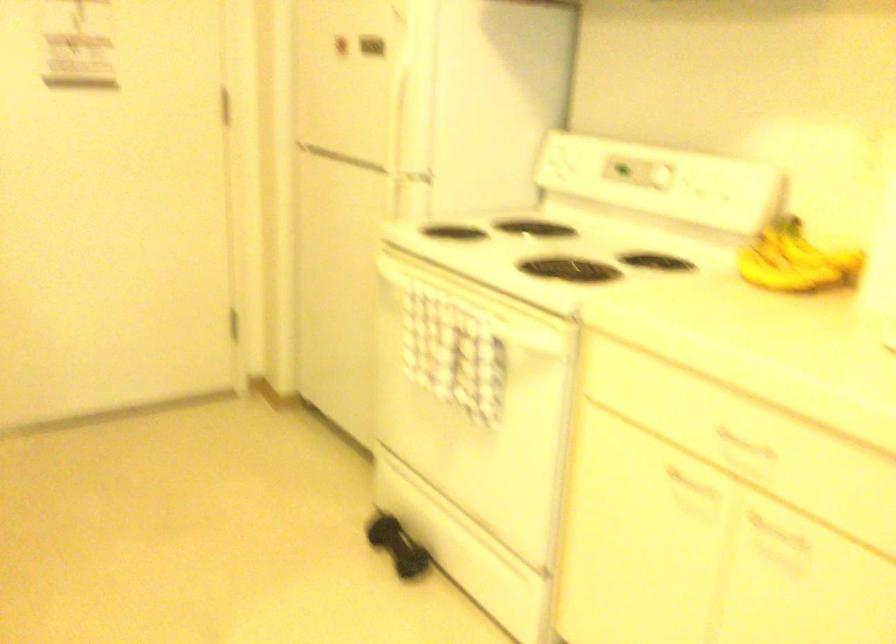
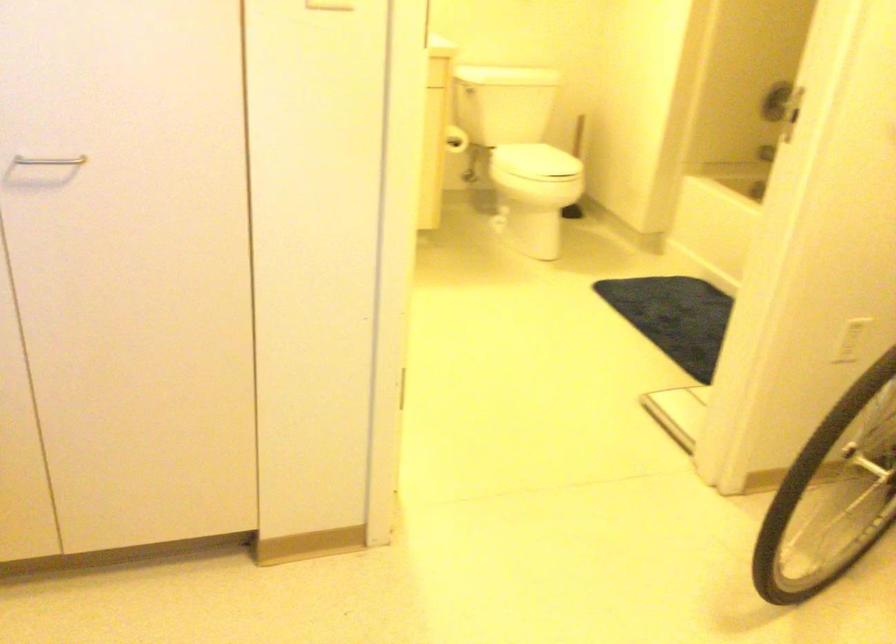
How did the camera likely rotate?

The camera rotated toward left-down.